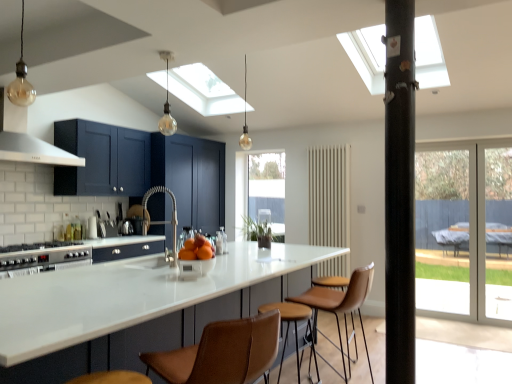
Question: From a real-world perspective, is silver metallic stove at lower left on brown leather bar stool at center?

Choices:
 (A) no
 (B) yes

Answer: (B)

Question: Can you confirm if silver metallic stove at lower left is bigger than brown leather bar stool at center?

Choices:
 (A) no
 (B) yes

Answer: (A)

Question: Is the position of silver metallic stove at lower left more distant than that of brown leather bar stool at center?

Choices:
 (A) no
 (B) yes

Answer: (B)

Question: From a real-world perspective, is silver metallic stove at lower left below brown leather bar stool at center?

Choices:
 (A) yes
 (B) no

Answer: (B)

Question: Is silver metallic stove at lower left not within brown leather bar stool at center?

Choices:
 (A) no
 (B) yes

Answer: (B)

Question: Is silver metallic stove at lower left shorter than brown leather bar stool at center?

Choices:
 (A) yes
 (B) no

Answer: (A)

Question: Is black matte pillar at center far away from clear glass window at center?

Choices:
 (A) yes
 (B) no

Answer: (A)

Question: Considering the relative positions of black matte pillar at center and clear glass window at center in the image provided, is black matte pillar at center to the right of clear glass window at center from the viewer's perspective?

Choices:
 (A) yes
 (B) no

Answer: (A)

Question: Does black matte pillar at center have a lesser width compared to clear glass window at center?

Choices:
 (A) no
 (B) yes

Answer: (A)

Question: Can you confirm if black matte pillar at center is taller than clear glass window at center?

Choices:
 (A) yes
 (B) no

Answer: (A)

Question: Is black matte pillar at center smaller than clear glass window at center?

Choices:
 (A) no
 (B) yes

Answer: (A)

Question: From the image's perspective, does black matte pillar at center appear lower than clear glass window at center?

Choices:
 (A) no
 (B) yes

Answer: (A)

Question: Considering the relative sizes of translucent glass bulb at center, which appears as the first light fixture when viewed from the back, and clear glass window at center in the image provided, is translucent glass bulb at center, which appears as the first light fixture when viewed from the back, bigger than clear glass window at center?

Choices:
 (A) no
 (B) yes

Answer: (A)